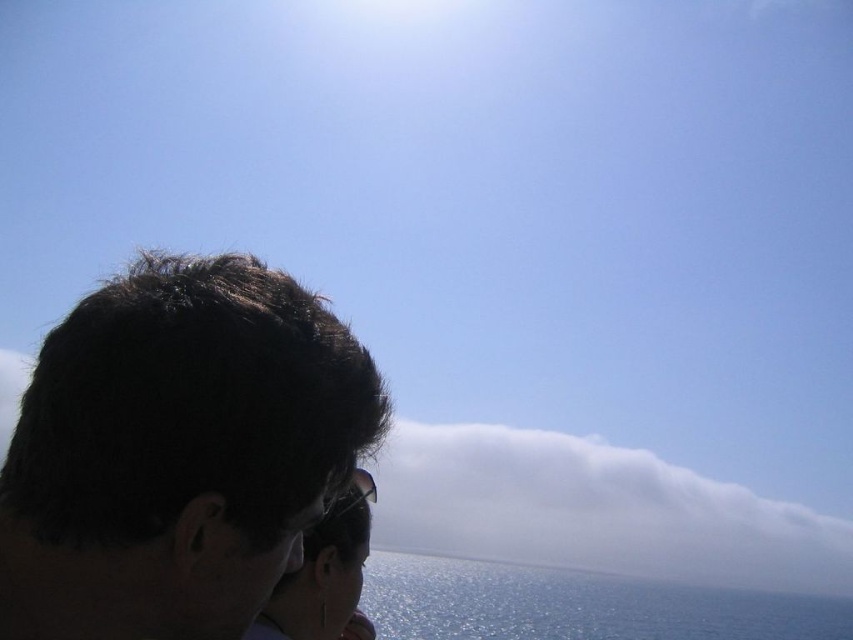
Question: Among these points, which one is nearest to the camera?

Choices:
 (A) (74, 444)
 (B) (741, 541)
 (C) (305, 573)

Answer: (A)

Question: Which point is farther from the camera taking this photo?

Choices:
 (A) (335, 550)
 (B) (560, 492)
 (C) (387, 564)

Answer: (B)

Question: Is the position of dark brown hair at left more distant than that of blue glossy water at lower center?

Choices:
 (A) yes
 (B) no

Answer: (B)

Question: Is dark brown hair at left positioned at the back of white fluffy cloud at lower center?

Choices:
 (A) yes
 (B) no

Answer: (B)

Question: Which object is farther from the camera taking this photo?

Choices:
 (A) blue glossy water at lower center
 (B) sunglasses at center
 (C) white fluffy cloud at lower center
 (D) dark brown hair at left

Answer: (C)

Question: From the image, what is the correct spatial relationship of blue glossy water at lower center in relation to sunglasses at center?

Choices:
 (A) left
 (B) right

Answer: (B)